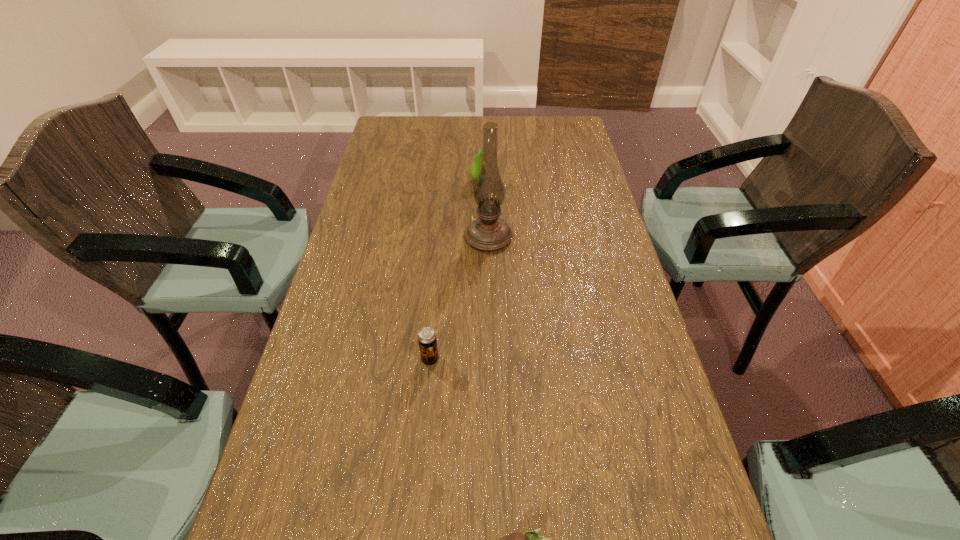
Image resolution: width=960 pixels, height=540 pixels. I want to click on vacant space at the left edge of the desktop, so click(x=372, y=234).

The width and height of the screenshot is (960, 540). Identify the location of vacant space at the right edge. (580, 159).

At what (x,y) coordinates should I click in order to perform the action: click on vacant area between the farther avocado and the third farthest object. Please return your answer as a coordinate pair (x, y). The width and height of the screenshot is (960, 540). Looking at the image, I should click on tap(454, 271).

Where is `object that is the nearest to the taller avocado`? Image resolution: width=960 pixels, height=540 pixels. object that is the nearest to the taller avocado is located at coordinates (488, 232).

Locate which object is the closest to the shorter avocado. Please provide its 2D coordinates. Your answer should be formatted as a tuple, i.e. [(x, y)], where the tuple contains the x and y coordinates of a point satisfying the conditions above.

[(427, 340)]

The height and width of the screenshot is (540, 960). In order to click on free space in the image that satisfies the following two spatial constraints: 1. on the cut side of the taller avocado; 2. on the right side of the tallest object in this screenshot , I will do `click(478, 237)`.

The height and width of the screenshot is (540, 960). Find the location of `free region that satisfies the following two spatial constraints: 1. on the cut side of the farther avocado; 2. on the back side of the second farthest object`. free region that satisfies the following two spatial constraints: 1. on the cut side of the farther avocado; 2. on the back side of the second farthest object is located at coordinates (478, 237).

The width and height of the screenshot is (960, 540). In order to click on free space that satisfies the following two spatial constraints: 1. on the cut side of the farther avocado; 2. on the left side of the oil lamp in this screenshot , I will do `click(478, 237)`.

In order to click on free space that satisfies the following two spatial constraints: 1. on the cut side of the taller avocado; 2. on the front side of the beer can in this screenshot , I will do pos(477,359).